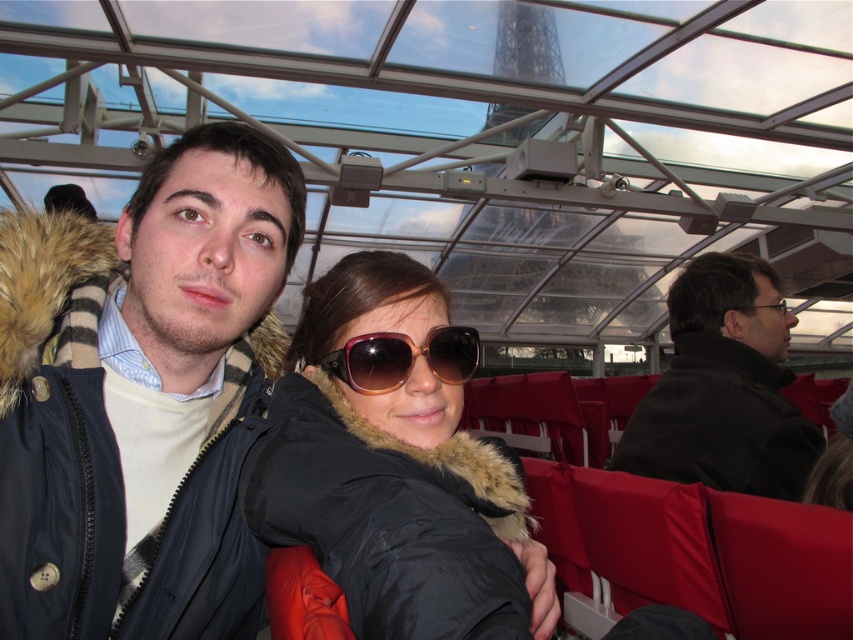
Who is taller, dark blue jacket at center or dark brown leather jacket at right?

dark blue jacket at center

Does dark blue jacket at center have a lesser height compared to dark brown leather jacket at right?

No, dark blue jacket at center is not shorter than dark brown leather jacket at right.

This screenshot has width=853, height=640. Describe the element at coordinates (142, 388) in the screenshot. I see `dark blue jacket at center` at that location.

Find the location of `dark blue jacket at center`. dark blue jacket at center is located at coordinates (142, 388).

Does brown gradient plastic sunglasses at center appear on the right side of clear plastic glasses at center?

In fact, brown gradient plastic sunglasses at center is to the left of clear plastic glasses at center.

Is point (375, 371) positioned after point (753, 308)?

No, (375, 371) is closer to viewer.

Find the location of a particular element. brown gradient plastic sunglasses at center is located at coordinates (403, 358).

Which is below, dark brown leather jacket at right or clear plastic glasses at center?

Positioned lower is dark brown leather jacket at right.

In the scene shown: Is dark brown leather jacket at right shorter than clear plastic glasses at center?

No.

Which is in front, point (730, 458) or point (762, 307)?

Point (730, 458)

Locate an element on the screen. This screenshot has width=853, height=640. dark brown leather jacket at right is located at coordinates (723, 388).